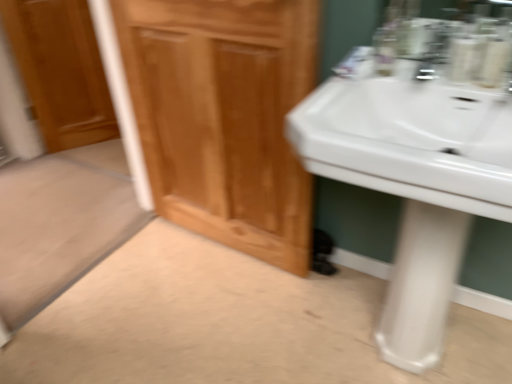
Question: Does wooden cabinet at center have a greater height compared to white glossy sink at right?

Choices:
 (A) no
 (B) yes

Answer: (B)

Question: Considering the relative positions of wooden cabinet at center and white glossy sink at right in the image provided, is wooden cabinet at center to the left of white glossy sink at right from the viewer's perspective?

Choices:
 (A) no
 (B) yes

Answer: (B)

Question: Is wooden cabinet at center further to the viewer compared to white glossy sink at right?

Choices:
 (A) yes
 (B) no

Answer: (A)

Question: Is there a large distance between wooden cabinet at center and white glossy sink at right?

Choices:
 (A) yes
 (B) no

Answer: (B)

Question: Can you confirm if wooden cabinet at center is thinner than white glossy sink at right?

Choices:
 (A) no
 (B) yes

Answer: (B)

Question: From a real-world perspective, relative to white glossy sink at right, is white glossy pedestal at lower right vertically above or below?

Choices:
 (A) above
 (B) below

Answer: (B)

Question: Is white glossy pedestal at lower right spatially inside white glossy sink at right, or outside of it?

Choices:
 (A) inside
 (B) outside

Answer: (B)

Question: In terms of width, does white glossy pedestal at lower right look wider or thinner when compared to white glossy sink at right?

Choices:
 (A) thin
 (B) wide

Answer: (A)

Question: From the image's perspective, relative to white glossy sink at right, is white glossy pedestal at lower right above or below?

Choices:
 (A) above
 (B) below

Answer: (B)

Question: Considering the positions of white glossy pedestal at lower right and wooden cabinet at center in the image, is white glossy pedestal at lower right taller or shorter than wooden cabinet at center?

Choices:
 (A) tall
 (B) short

Answer: (B)

Question: From the image's perspective, relative to wooden cabinet at center, is white glossy pedestal at lower right above or below?

Choices:
 (A) above
 (B) below

Answer: (B)

Question: Considering the positions of point (415, 261) and point (290, 26), is point (415, 261) closer or farther from the camera than point (290, 26)?

Choices:
 (A) closer
 (B) farther

Answer: (A)

Question: Considering the positions of white glossy pedestal at lower right and wooden cabinet at center in the image, is white glossy pedestal at lower right bigger or smaller than wooden cabinet at center?

Choices:
 (A) small
 (B) big

Answer: (A)

Question: Is wooden cabinet at center taller or shorter than wooden door at left?

Choices:
 (A) short
 (B) tall

Answer: (B)

Question: Looking at the image, does wooden cabinet at center seem bigger or smaller compared to wooden door at left?

Choices:
 (A) big
 (B) small

Answer: (A)